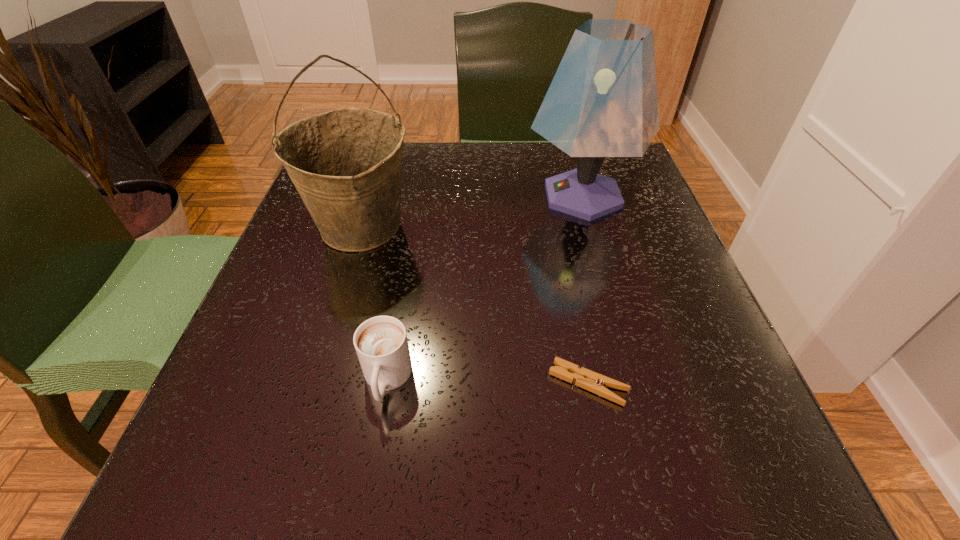
Locate an element on the screen. lampshade is located at coordinates (602, 102).

At what (x,y) coordinates should I click in order to perform the action: click on wine bucket. Please return your answer as a coordinate pair (x, y). The image size is (960, 540). Looking at the image, I should click on (346, 164).

Image resolution: width=960 pixels, height=540 pixels. I want to click on the third tallest object, so click(x=381, y=344).

Where is `clothespin`? Image resolution: width=960 pixels, height=540 pixels. clothespin is located at coordinates coord(596,383).

Identify the location of free space located 0.080m on the base of the lampshade. (488, 196).

At what (x,y) coordinates should I click in order to perform the action: click on free location located on the base of the lampshade. Please return your answer as a coordinate pair (x, y). This screenshot has width=960, height=540. Looking at the image, I should click on (483, 196).

You are a GUI agent. You are given a task and a screenshot of the screen. Output one action in this format:
    pyautogui.click(x=<x>, y=<y>)
    Task: Click on the free space located 0.320m on the base of the lampshade
    The height and width of the screenshot is (540, 960).
    Given the screenshot: What is the action you would take?
    pyautogui.click(x=376, y=196)

At what (x,y) coordinates should I click in order to perform the action: click on vacant space located on the right of the wine bucket. Please return your answer as a coordinate pair (x, y). The image size is (960, 540). Looking at the image, I should click on (578, 226).

The height and width of the screenshot is (540, 960). I want to click on free region located on the side with the handle of the second shortest object, so click(x=366, y=501).

I want to click on blank area located 0.370m on the back of the clothespin, so click(x=554, y=211).